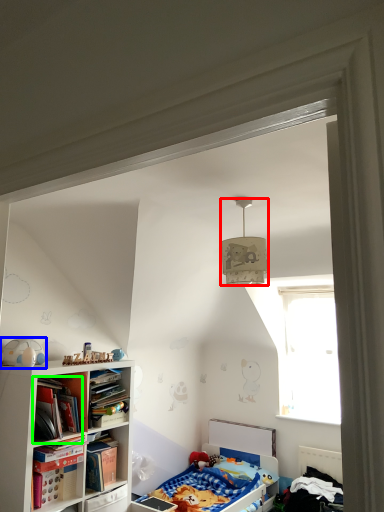
Question: Which object is positioned farthest from lamp (highlighted by a red box)? Select from toy (highlighted by a blue box) and book (highlighted by a green box).

Choices:
 (A) toy
 (B) book

Answer: (A)